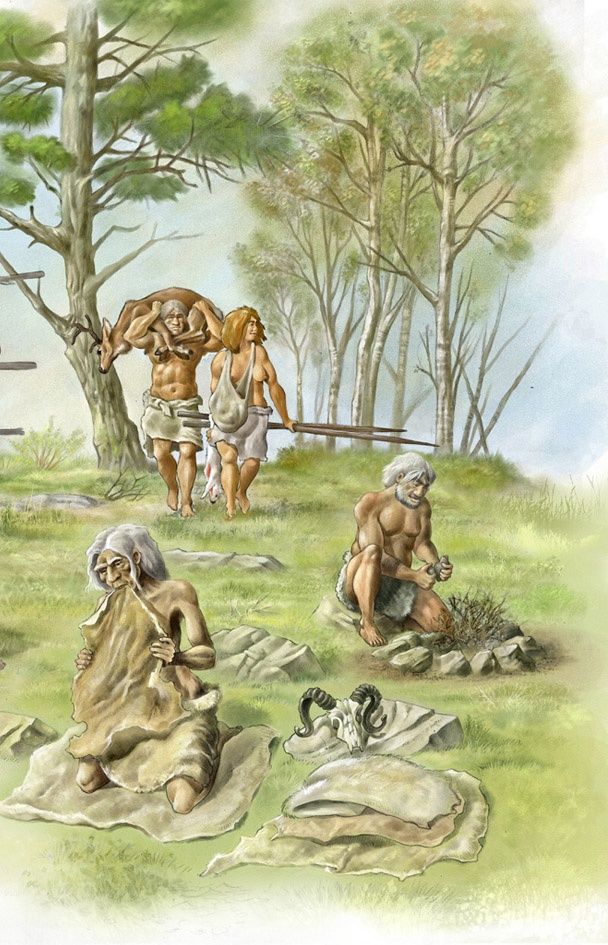
What are the coordinates of `blankets` in the screenshot? It's located at (247, 777), (356, 799), (425, 725).